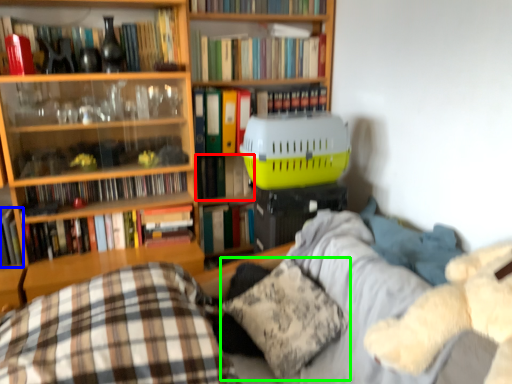
Question: Considering the real-world distances, which object is farthest from book (highlighted by a red box)? book (highlighted by a blue box) or pillow (highlighted by a green box)?

Choices:
 (A) book
 (B) pillow

Answer: (A)